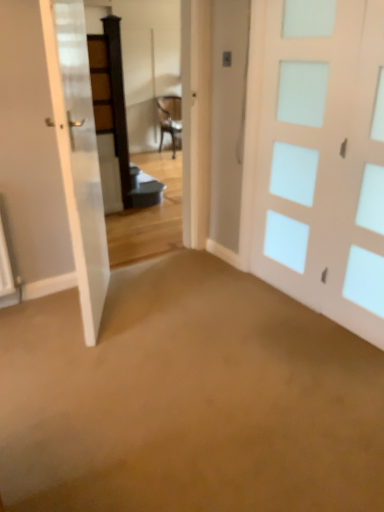
Question: Is white frosted glass door at right, the second door from the left, situated inside white glossy door at left, which is the 1th door in left-to-right order, or outside?

Choices:
 (A) outside
 (B) inside

Answer: (A)

Question: From the image's perspective, relative to white glossy door at left, which is the 1th door in left-to-right order, is white frosted glass door at right, the 1th door from the right, above or below?

Choices:
 (A) above
 (B) below

Answer: (A)

Question: From a real-world perspective, is white frosted glass door at right, the second door from the left, physically located above or below white glossy door at left, arranged as the second door when viewed from the right?

Choices:
 (A) above
 (B) below

Answer: (A)

Question: Based on their sizes in the image, would you say white glossy door at left, which is the 1th door in left-to-right order, is bigger or smaller than white frosted glass door at right, the 1th door from the right?

Choices:
 (A) big
 (B) small

Answer: (A)

Question: In terms of height, does white glossy door at left, which is the 1th door in left-to-right order, look taller or shorter compared to white frosted glass door at right, the 1th door from the right?

Choices:
 (A) short
 (B) tall

Answer: (A)

Question: From a real-world perspective, is white glossy door at left, which is the 1th door in left-to-right order, above or below white frosted glass door at right, the second door from the left?

Choices:
 (A) above
 (B) below

Answer: (B)

Question: Considering the positions of point (11, 109) and point (354, 266), is point (11, 109) closer or farther from the camera than point (354, 266)?

Choices:
 (A) farther
 (B) closer

Answer: (A)